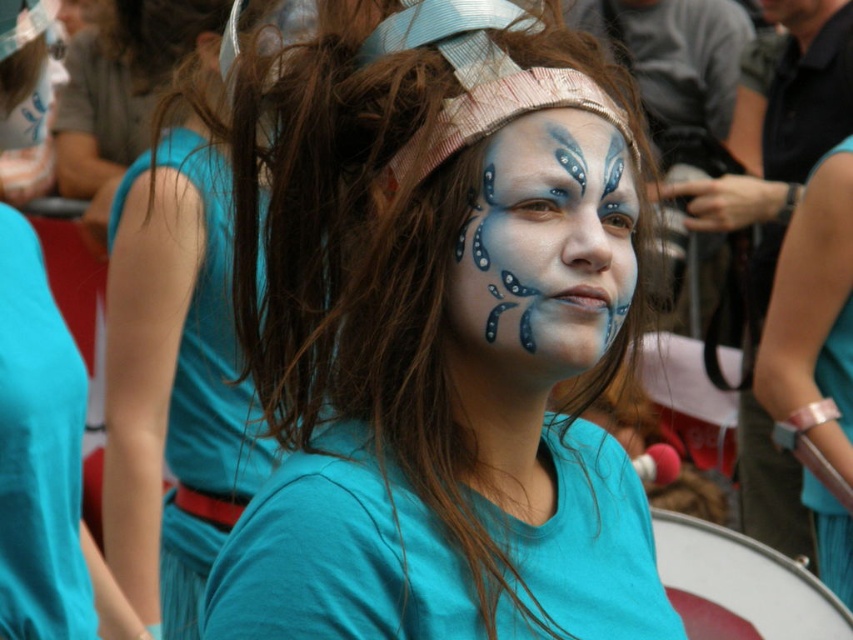
Can you confirm if turquoise fabric dress at left is wider than teal fabric dress at left?

Yes, turquoise fabric dress at left is wider than teal fabric dress at left.

Is turquoise fabric dress at left taller than teal fabric dress at left?

Indeed, turquoise fabric dress at left has a greater height compared to teal fabric dress at left.

What do you see at coordinates (173, 381) in the screenshot?
I see `turquoise fabric dress at left` at bounding box center [173, 381].

The height and width of the screenshot is (640, 853). Find the location of `turquoise fabric dress at left`. turquoise fabric dress at left is located at coordinates (173, 381).

Between turquoise fabric dress at left and white drum at lower right, which one is positioned lower?

white drum at lower right

Does turquoise fabric dress at left appear on the left side of white drum at lower right?

Indeed, turquoise fabric dress at left is positioned on the left side of white drum at lower right.

Which is in front, point (144, 460) or point (753, 595)?

Positioned in front is point (144, 460).

I want to click on turquoise fabric dress at left, so click(173, 381).

Can you confirm if matte blue face paint at center is positioned above teal fabric dress at left?

Indeed, matte blue face paint at center is positioned over teal fabric dress at left.

Describe the element at coordinates (437, 342) in the screenshot. I see `matte blue face paint at center` at that location.

Find the location of a particular element. The height and width of the screenshot is (640, 853). matte blue face paint at center is located at coordinates (437, 342).

The height and width of the screenshot is (640, 853). I want to click on matte blue face paint at center, so click(437, 342).